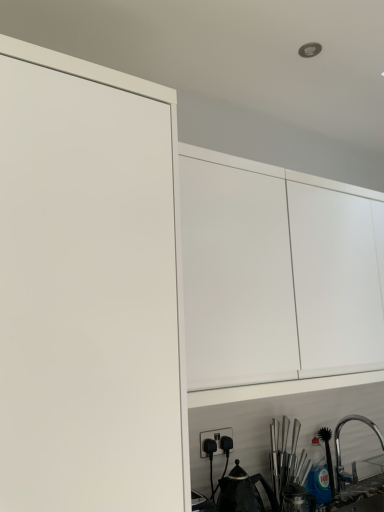
This screenshot has height=512, width=384. What do you see at coordinates (243, 492) in the screenshot?
I see `black matte tea pot at lower center` at bounding box center [243, 492].

Describe the element at coordinates (277, 279) in the screenshot. The height and width of the screenshot is (512, 384). I see `white matte cabinet at upper center` at that location.

In order to face black plastic electric outlet at lower center, should I rotate leftwards or rightwards?

Turn right by 3.624 degrees to look at black plastic electric outlet at lower center.

Image resolution: width=384 pixels, height=512 pixels. Find the location of `black plastic electric outlet at lower center`. black plastic electric outlet at lower center is located at coordinates (214, 439).

The image size is (384, 512). I want to click on black matte tea pot at lower center, so click(243, 492).

How far apart are black plastic electric outlet at lower center and white matte cabinet at upper center?

black plastic electric outlet at lower center and white matte cabinet at upper center are 25.59 inches apart.

In order to click on electric outlet lying behind the white matte cabinet at upper center in this screenshot , I will do `click(214, 439)`.

Would you say black plastic electric outlet at lower center contains white matte cabinet at upper center?

No, black plastic electric outlet at lower center does not contain white matte cabinet at upper center.

Is black plastic electric outlet at lower center positioned with its back to white matte cabinet at upper center?

No, black plastic electric outlet at lower center is not facing the opposite direction of white matte cabinet at upper center.

Who is taller, black plastic electric outlet at lower center or black matte tea pot at lower center?

black matte tea pot at lower center is taller.

Is black plastic electric outlet at lower center touching black matte tea pot at lower center?

No, black plastic electric outlet at lower center is not next to black matte tea pot at lower center.

Is black plastic electric outlet at lower center turned away from black matte tea pot at lower center?

No.

Which object is further away from the camera taking this photo, black plastic electric outlet at lower center or black matte tea pot at lower center?

black plastic electric outlet at lower center is further from the camera.

Is black plastic electric outlet at lower center positioned far away from satin nickel faucet at lower right?

black plastic electric outlet at lower center is actually quite close to satin nickel faucet at lower right.

Considering the sizes of objects black plastic electric outlet at lower center and satin nickel faucet at lower right in the image provided, who is shorter, black plastic electric outlet at lower center or satin nickel faucet at lower right?

Standing shorter between the two is black plastic electric outlet at lower center.

From the picture: Which is nearer, (212, 435) or (347, 419)?

The point (212, 435) is in front.

Could you tell me if satin nickel faucet at lower right is turned towards black plastic electric outlet at lower center?

No.

Between satin nickel faucet at lower right and black plastic electric outlet at lower center, which one appears on the right side from the viewer's perspective?

satin nickel faucet at lower right is more to the right.

Is satin nickel faucet at lower right further to the viewer compared to black plastic electric outlet at lower center?

Yes.

Is satin nickel faucet at lower right positioned far away from black plastic electric outlet at lower center?

satin nickel faucet at lower right is near black plastic electric outlet at lower center, not far away.

Which is behind, black matte tea pot at lower center or satin nickel faucet at lower right?

satin nickel faucet at lower right is more distant.

Which of these two, black matte tea pot at lower center or satin nickel faucet at lower right, is wider?

satin nickel faucet at lower right is wider.

Locate an element on the screen. tap below the black matte tea pot at lower center (from the image's perspective) is located at coordinates (339, 440).

Is point (205, 241) positioned before point (232, 432)?

Yes, point (205, 241) is in front of point (232, 432).

Looking at this image, is white matte cabinet at upper center oriented towards black plastic electric outlet at lower center?

No.

How many degrees apart are the facing directions of white matte cabinet at upper center and black plastic electric outlet at lower center?

There is a 0.939-degree angle between the facing directions of white matte cabinet at upper center and black plastic electric outlet at lower center.

Can you see white matte cabinet at upper center touching black plastic electric outlet at lower center?

No.

From the image's perspective, between white matte cabinet at upper center and black matte tea pot at lower center, which one is located above?

white matte cabinet at upper center.

Which is more to the left, white matte cabinet at upper center or black matte tea pot at lower center?

black matte tea pot at lower center is more to the left.

From a real-world perspective, is white matte cabinet at upper center positioned above or below black matte tea pot at lower center?

white matte cabinet at upper center is situated higher than black matte tea pot at lower center in the real world.

Is point (222, 177) closer to viewer compared to point (230, 504)?

Yes, point (222, 177) is closer to viewer.

Find the location of a particular element. Image resolution: width=384 pixels, height=512 pixels. electric outlet below the white matte cabinet at upper center (from the image's perspective) is located at coordinates (214, 439).

The image size is (384, 512). In order to click on tea pot in front of the black plastic electric outlet at lower center in this screenshot , I will do `click(243, 492)`.

Which object lies nearer to the anchor point satin nickel faucet at lower right, white matte cabinet at upper center or black matte tea pot at lower center?

black matte tea pot at lower center.

Based on their spatial positions, is black plastic electric outlet at lower center or satin nickel faucet at lower right closer to black matte tea pot at lower center?

Based on the image, black plastic electric outlet at lower center appears to be nearer to black matte tea pot at lower center.

Based on their spatial positions, is white matte cabinet at upper center or satin nickel faucet at lower right further from black matte tea pot at lower center?

white matte cabinet at upper center.

Considering their positions, is satin nickel faucet at lower right positioned closer to white matte cabinet at upper center than black plastic electric outlet at lower center?

Based on the image, black plastic electric outlet at lower center appears to be nearer to white matte cabinet at upper center.

Based on their spatial positions, is satin nickel faucet at lower right or black matte tea pot at lower center further from white matte cabinet at upper center?

Among the two, satin nickel faucet at lower right is located further to white matte cabinet at upper center.

Considering their positions, is black plastic electric outlet at lower center positioned closer to satin nickel faucet at lower right than black matte tea pot at lower center?

black matte tea pot at lower center is closer to satin nickel faucet at lower right.

Considering their positions, is black plastic electric outlet at lower center positioned further to white matte cabinet at upper center than black matte tea pot at lower center?

black matte tea pot at lower center.

Estimate the real-world distances between objects in this image. Which object is further from black matte tea pot at lower center, black plastic electric outlet at lower center or white matte cabinet at upper center?

Among the two, white matte cabinet at upper center is located further to black matte tea pot at lower center.

Identify the location of tea pot that lies between white matte cabinet at upper center and satin nickel faucet at lower right from top to bottom. This screenshot has width=384, height=512. (243, 492).

The image size is (384, 512). Find the location of `tea pot situated between black plastic electric outlet at lower center and satin nickel faucet at lower right from left to right`. tea pot situated between black plastic electric outlet at lower center and satin nickel faucet at lower right from left to right is located at coordinates (243, 492).

Find the location of a particular element. The height and width of the screenshot is (512, 384). electric outlet between white matte cabinet at upper center and satin nickel faucet at lower right in the up-down direction is located at coordinates (214, 439).

This screenshot has height=512, width=384. What are the coordinates of `electric outlet between white matte cabinet at upper center and black matte tea pot at lower center in the up-down direction` in the screenshot? It's located at (214, 439).